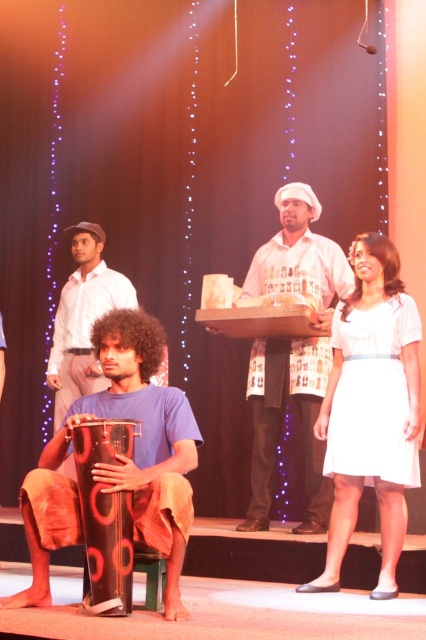
Question: Which point is closer to the camera taking this photo?

Choices:
 (A) (311, 456)
 (B) (126, 563)
 (C) (397, 275)
 (D) (144, 419)

Answer: (B)

Question: Does white printed shirt at center appear on the right side of black plastic drum at lower left?

Choices:
 (A) yes
 (B) no

Answer: (A)

Question: Which point is farther from the camera taking this photo?

Choices:
 (A) (362, 476)
 (B) (129, 452)
 (C) (180, 536)

Answer: (A)

Question: Can you confirm if white cotton dress at center is thinner than white printed shirt at center?

Choices:
 (A) yes
 (B) no

Answer: (A)

Question: Considering the relative positions of white cotton dress at center and black matte drum at lower left in the image provided, where is white cotton dress at center located with respect to black matte drum at lower left?

Choices:
 (A) left
 (B) right

Answer: (B)

Question: Estimate the real-world distances between objects in this image. Which object is farther from the white printed shirt at center?

Choices:
 (A) white cotton dress at center
 (B) black plastic drum at lower left
 (C) black matte drum at lower left

Answer: (B)